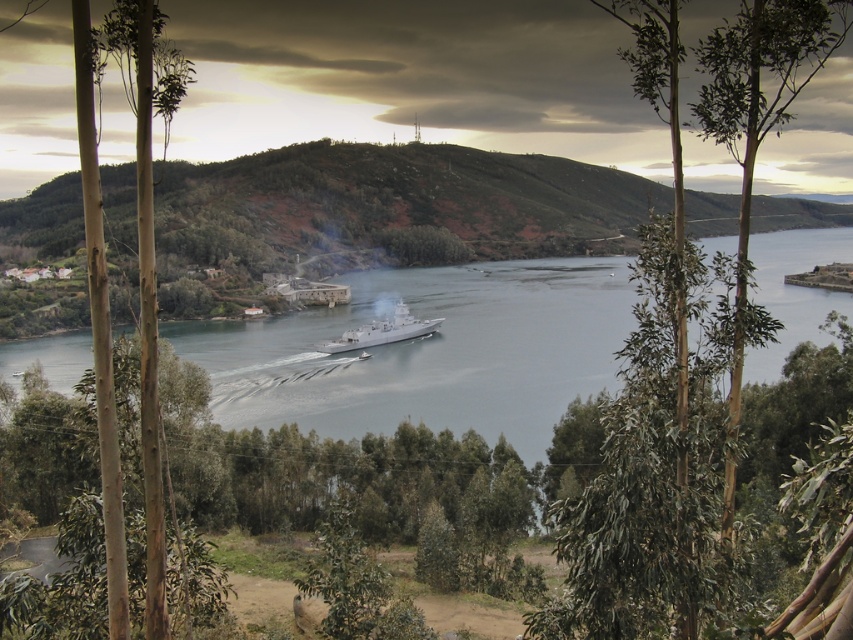
You are a bird flying over the landscape. You see the green leafy tree at center and the silver metallic ship at center. Which one is taller?

The green leafy tree at center is much taller than the silver metallic ship at center.

You are standing on the bank of the river and see the green leafy tree at center and the silver metallic ship at center. Which object is closer to you?

The green leafy tree at center is closer to you because it is positioned under the silver metallic ship at center, indicating it is in front from your perspective.